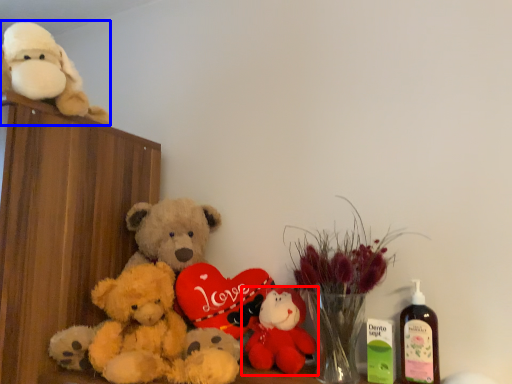
Question: Among these objects, which one is nearest to the camera, toy (highlighted by a red box) or teddy bear (highlighted by a blue box)?

Choices:
 (A) toy
 (B) teddy bear

Answer: (B)